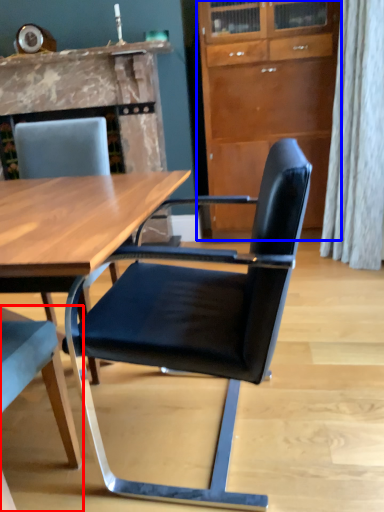
Question: Which object is closer to the camera taking this photo, chair (highlighted by a red box) or cabinetry (highlighted by a blue box)?

Choices:
 (A) chair
 (B) cabinetry

Answer: (A)